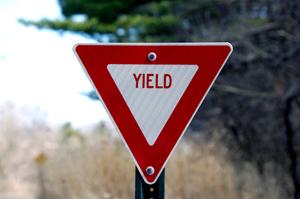
I want to click on upper washer, so click(x=154, y=57).